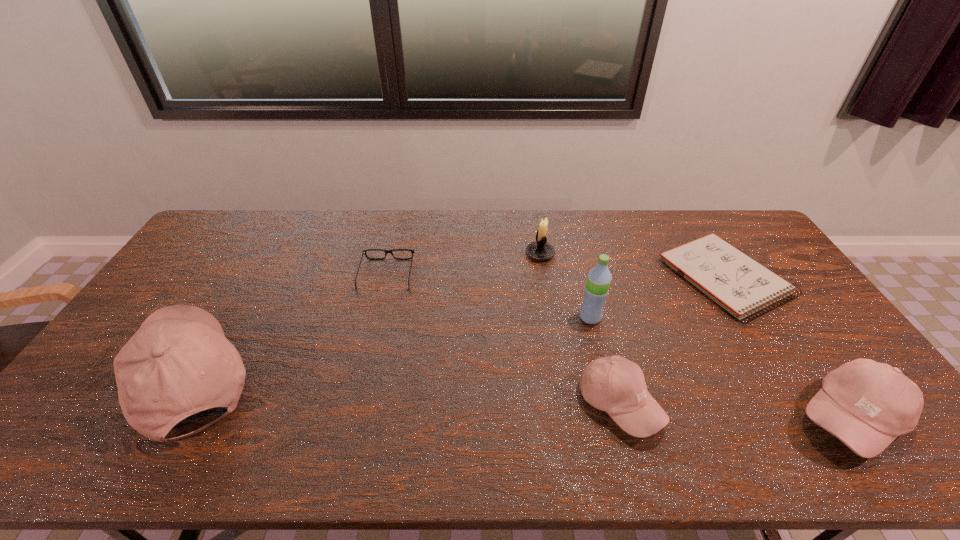
This screenshot has width=960, height=540. In order to click on the tallest baseball cap in this screenshot , I will do `click(179, 362)`.

Locate an element on the screen. The height and width of the screenshot is (540, 960). the leftmost object is located at coordinates (179, 362).

You are a GUI agent. You are given a task and a screenshot of the screen. Output one action in this format:
    pyautogui.click(x=<x>, y=<y>)
    Task: Click on the second baseball cap from right to left
    
    Given the screenshot: What is the action you would take?
    pyautogui.click(x=614, y=384)

Find the location of a particular element. the fifth tallest object is located at coordinates (614, 384).

The width and height of the screenshot is (960, 540). What are the coordinates of `the rightmost baseball cap` in the screenshot? It's located at (867, 405).

Image resolution: width=960 pixels, height=540 pixels. I want to click on candle holder, so click(540, 250).

Find the location of a particular element. notepad is located at coordinates (741, 285).

The height and width of the screenshot is (540, 960). Find the location of `the second object from left to right`. the second object from left to right is located at coordinates (364, 251).

Locate an element on the screen. water bottle is located at coordinates (599, 278).

Identify the location of free region located on the front-facing side of the leftmost object. The width and height of the screenshot is (960, 540). (100, 378).